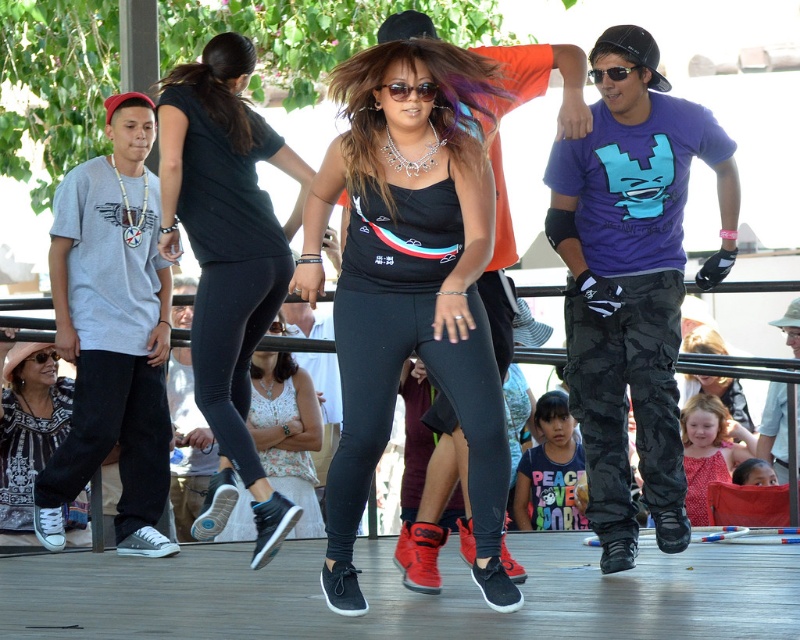
Question: Which point is closer to the camera taking this photo?

Choices:
 (A) (572, 298)
 (B) (224, 280)

Answer: (A)

Question: Among these objects, which one is nearest to the camera?

Choices:
 (A) matte red dress at lower right
 (B) camo-patterned pants at right

Answer: (B)

Question: Is purple matte t-shirt at center in front of black matte leggings at center?

Choices:
 (A) no
 (B) yes

Answer: (A)

Question: Is black leggings at center further to the viewer compared to camo-patterned pants at right?

Choices:
 (A) no
 (B) yes

Answer: (A)

Question: Which point appears farthest from the camera in this image?

Choices:
 (A) (660, 131)
 (B) (400, 186)
 (C) (600, 465)

Answer: (A)

Question: Can you confirm if black matte tank top at center is smaller than black leggings at center?

Choices:
 (A) yes
 (B) no

Answer: (A)